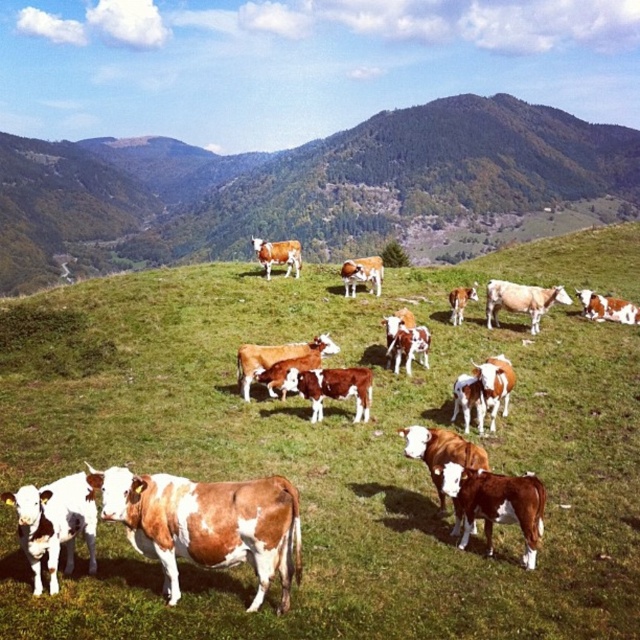
Based on the photo, you are a farmer who wants to move your cow to a higher elevation for better grazing. Given the scene, can the brown speckled cow at center climb the brown grassy hillside at center?

The brown grassy hillside at center is much taller than the brown speckled cow at center, so the cow can climb the hillside as it is a common behavior for cows to climb hills for grazing.